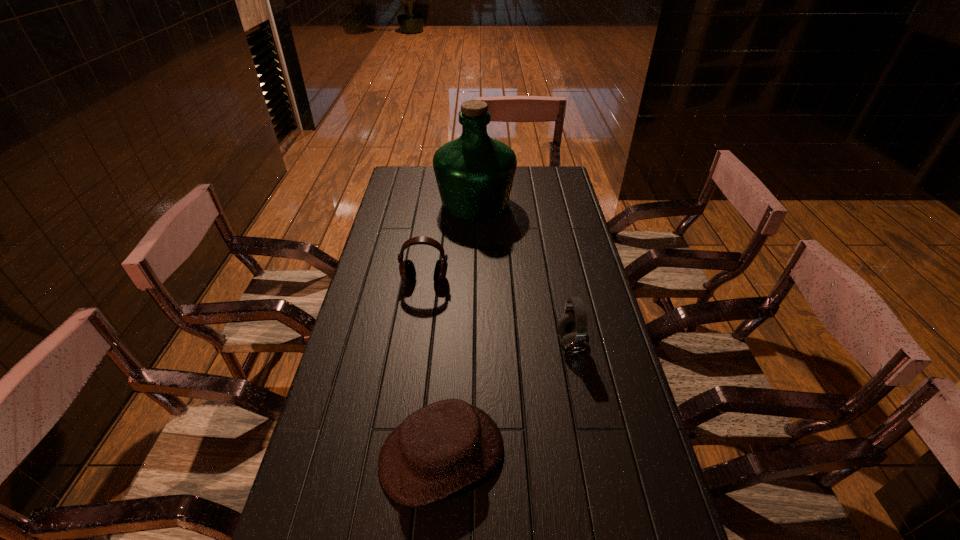
You are a GUI agent. You are given a task and a screenshot of the screen. Output one action in this format:
    pyautogui.click(x=<x>, y=<y>)
    Task: Click on the farthest object
    This screenshot has height=540, width=960.
    Given the screenshot: What is the action you would take?
    pyautogui.click(x=474, y=173)

Locate an element on the screen. The height and width of the screenshot is (540, 960). liquor is located at coordinates (474, 173).

Where is `the left headset`? the left headset is located at coordinates (407, 271).

At what (x,y) coordinates should I click in order to perform the action: click on the farther headset. Please return your answer as a coordinate pair (x, y). This screenshot has height=540, width=960. Looking at the image, I should click on (407, 271).

Where is `the second nearest object`? the second nearest object is located at coordinates (572, 326).

Find the location of a particular element. the right headset is located at coordinates (572, 326).

This screenshot has width=960, height=540. I want to click on the shortest object, so click(x=443, y=447).

Locate an element on the screen. The height and width of the screenshot is (540, 960). hat is located at coordinates (443, 447).

Identify the location of vacant region located 0.120m on the label side of the liquor. The width and height of the screenshot is (960, 540). (543, 202).

Find the location of `vacant point located 0.130m on the ear pads of the farther headset`. vacant point located 0.130m on the ear pads of the farther headset is located at coordinates (420, 316).